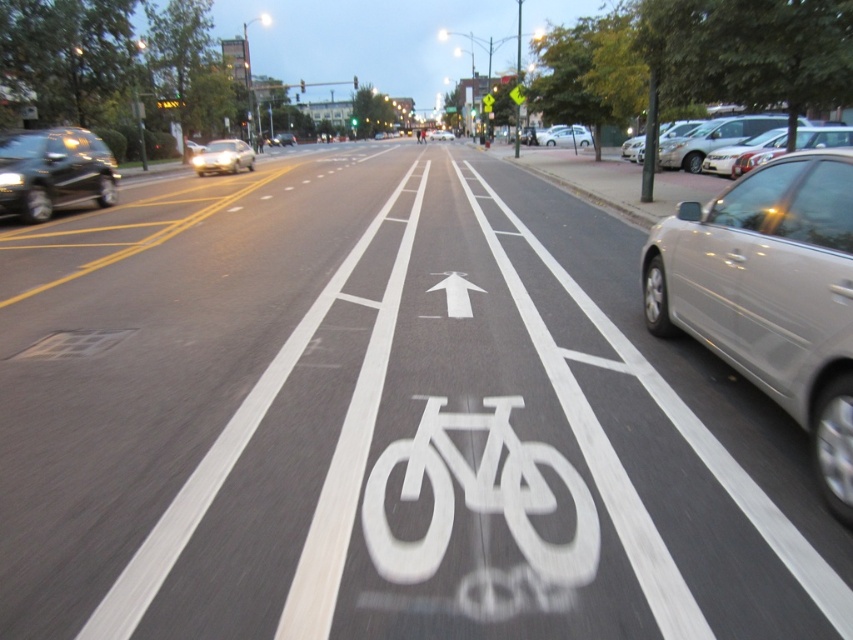
Question: Which object is positioned farthest from the white matte sedan at center?

Choices:
 (A) satin silver sedan at center-left
 (B) silver metallic car at right

Answer: (B)

Question: Which point is farther to the camera?

Choices:
 (A) white matte sedan at center
 (B) satin silver sedan at center-left
 (C) matte black suv at left
 (D) silver metallic car at right

Answer: (A)

Question: Can you confirm if satin silver sedan at center-left is thinner than white matte sedan at center?

Choices:
 (A) no
 (B) yes

Answer: (A)

Question: Observing the image, what is the correct spatial positioning of matte black suv at left in reference to white matte sedan at center?

Choices:
 (A) left
 (B) right

Answer: (A)

Question: Is matte black suv at left further to the viewer compared to satin silver sedan at center-left?

Choices:
 (A) yes
 (B) no

Answer: (B)

Question: Which of the following is the farthest from the observer?

Choices:
 (A) (848, 449)
 (B) (584, 144)

Answer: (B)